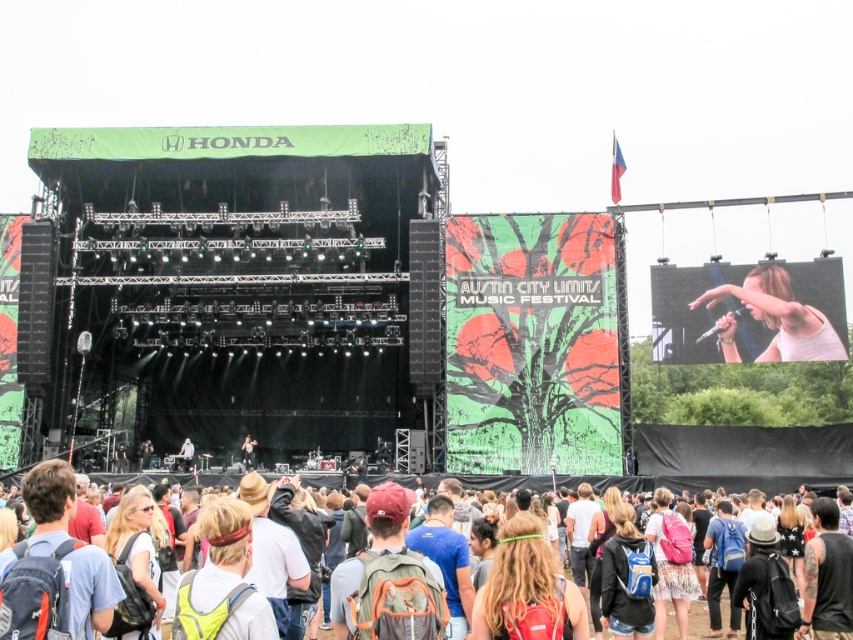
Can you confirm if white matte shirt at upper right is positioned to the left of white cotton shirt at lower center?

No, white matte shirt at upper right is not to the left of white cotton shirt at lower center.

Is point (721, 348) positioned behind point (699, 544)?

Yes, point (721, 348) is behind point (699, 544).

At what (x,y) coordinates should I click in order to perform the action: click on white matte shirt at upper right. Please return your answer as a coordinate pair (x, y). The width and height of the screenshot is (853, 640). Looking at the image, I should click on (781, 316).

Which is in front, point (772, 342) or point (242, 444)?

Point (772, 342) is in front.

Which of these two, white matte shirt at upper right or matte black jacket at center, stands shorter?

matte black jacket at center is shorter.

Looking at this image, who is more forward, (x=784, y=282) or (x=248, y=442)?

Positioned in front is point (x=784, y=282).

Where is `white matte shirt at upper right`? white matte shirt at upper right is located at coordinates coord(781,316).

Does white cotton shirt at lower center appear on the left side of matte black jacket at center?

In fact, white cotton shirt at lower center is to the right of matte black jacket at center.

Does white cotton shirt at lower center appear under matte black jacket at center?

Yes, white cotton shirt at lower center is below matte black jacket at center.

Does point (698, 525) come closer to viewer compared to point (247, 442)?

Yes.

You are a GUI agent. You are given a task and a screenshot of the screen. Output one action in this format:
    pyautogui.click(x=<x>, y=<y>)
    Task: Click on the white cotton shirt at lower center
    
    Given the screenshot: What is the action you would take?
    pyautogui.click(x=405, y=483)